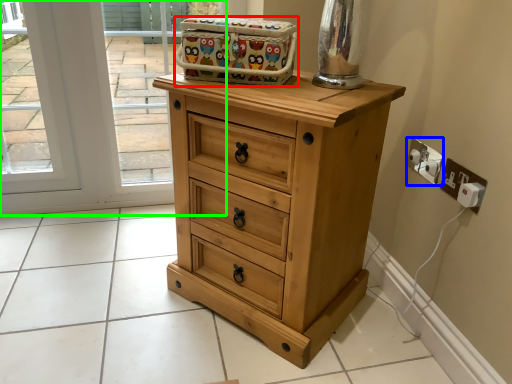
Question: Considering the real-world distances, which object is closest to crate (highlighted by a red box)? electric outlet (highlighted by a blue box) or window sill (highlighted by a green box).

Choices:
 (A) electric outlet
 (B) window sill

Answer: (A)